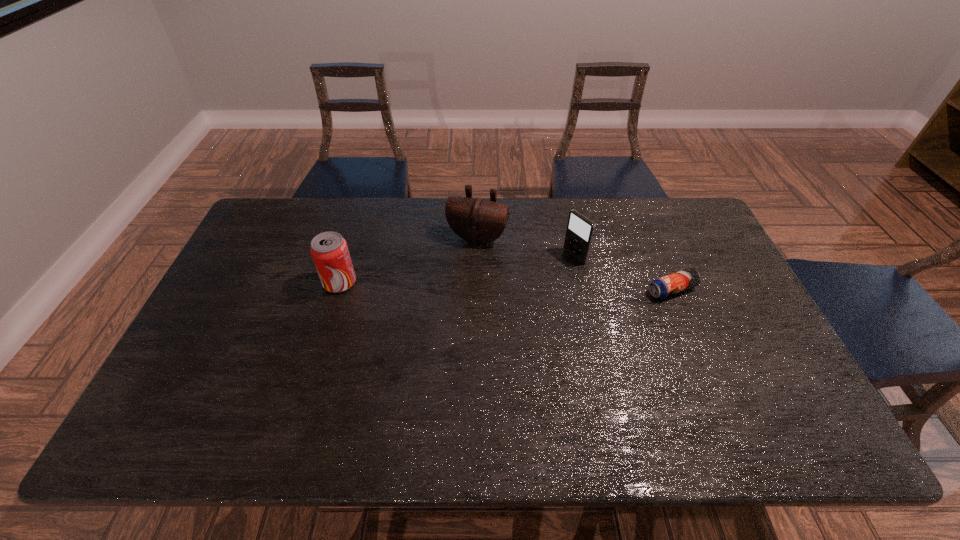
Image resolution: width=960 pixels, height=540 pixels. What are the coordinates of `soda can` in the screenshot? It's located at (329, 250).

At what (x,y) coordinates should I click in order to perform the action: click on the rightmost object. Please return your answer as a coordinate pair (x, y). Looking at the image, I should click on (668, 285).

Where is `beer can`? beer can is located at coordinates (668, 285).

Locate an element on the screen. the second object from right to left is located at coordinates (580, 230).

I want to click on the third object from right to left, so click(476, 220).

This screenshot has width=960, height=540. Find the location of `vacant space located 0.160m on the right of the soda can`. vacant space located 0.160m on the right of the soda can is located at coordinates (410, 282).

Where is `free space located 0.160m on the back of the beer can`? This screenshot has width=960, height=540. free space located 0.160m on the back of the beer can is located at coordinates (653, 242).

Where is `free location located on the front-facing side of the second object from right to left`? This screenshot has height=540, width=960. free location located on the front-facing side of the second object from right to left is located at coordinates (476, 315).

Identify the location of free space located 0.260m on the front-facing side of the second object from right to left. The image size is (960, 540). (503, 299).

Locate an element on the screen. vacant area situated on the front-facing side of the second object from right to left is located at coordinates (503, 299).